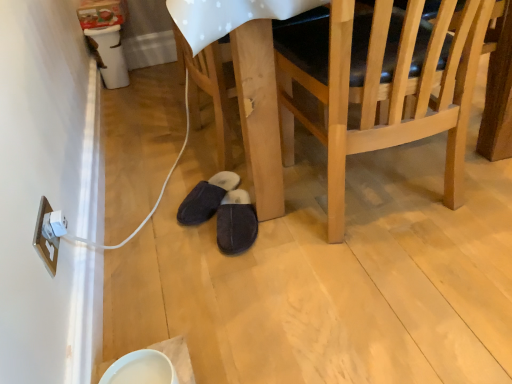
You are a GUI agent. You are given a task and a screenshot of the screen. Output one action in this format:
    pyautogui.click(x=<x>, y=<y>)
    Task: Click on the white plastic electric outlet at lower left
    The image size is (512, 384).
    Given the screenshot: What is the action you would take?
    pyautogui.click(x=46, y=238)

Locate an element on the screen. dark gray suede slippers at lower center, placed as the 2th footwear when sorted from left to right is located at coordinates (236, 223).

Is point (232, 250) more distant than point (463, 34)?

Yes, point (232, 250) is behind point (463, 34).

From their relative heights in the image, would you say dark gray suede slippers at lower center, placed as the 2th footwear when sorted from left to right, is taller or shorter than light wood chair at center?

Considering their sizes, dark gray suede slippers at lower center, placed as the 2th footwear when sorted from left to right, has less height than light wood chair at center.

From a real-world perspective, which is physically below, dark gray suede slippers at lower center, placed as the 2th footwear when sorted from left to right, or light wood chair at center?

dark gray suede slippers at lower center, placed as the 2th footwear when sorted from left to right, from a real-world perspective.

Is dark gray suede slippers at lower center, the 1th footwear from the right, closer to camera compared to light wood chair at center?

No, the depth of dark gray suede slippers at lower center, the 1th footwear from the right, is greater than that of light wood chair at center.

Where is `footwear that is the 2nd object located behind the light wood chair at center`? The width and height of the screenshot is (512, 384). footwear that is the 2nd object located behind the light wood chair at center is located at coordinates (206, 198).

Considering the relative sizes of black suede slippers at lower center, the 2th footwear positioned from the right, and light wood chair at center in the image provided, is black suede slippers at lower center, the 2th footwear positioned from the right, shorter than light wood chair at center?

Yes.

Can you tell me how much black suede slippers at lower center, the first footwear viewed from the left, and light wood chair at center differ in facing direction?

black suede slippers at lower center, the first footwear viewed from the left, and light wood chair at center are facing 142 degrees away from each other.

How far apart are black suede slippers at lower center, the first footwear viewed from the left, and light wood chair at center?

The distance of black suede slippers at lower center, the first footwear viewed from the left, from light wood chair at center is 21.58 inches.

From the picture: Does white plastic electric outlet at lower left have a larger size compared to dark gray suede slippers at lower center, placed as the 2th footwear when sorted from left to right?

Actually, white plastic electric outlet at lower left might be smaller than dark gray suede slippers at lower center, placed as the 2th footwear when sorted from left to right.

Which object is more forward, white plastic electric outlet at lower left or dark gray suede slippers at lower center, placed as the 2th footwear when sorted from left to right?

Positioned in front is white plastic electric outlet at lower left.

From a real-world perspective, is white plastic electric outlet at lower left under black suede slippers at lower center, the first footwear viewed from the left?

Incorrect, from a real-world perspective, white plastic electric outlet at lower left is higher than black suede slippers at lower center, the first footwear viewed from the left.

Is white plastic electric outlet at lower left inside or outside of black suede slippers at lower center, the first footwear viewed from the left?

white plastic electric outlet at lower left exists outside the volume of black suede slippers at lower center, the first footwear viewed from the left.

Does white plastic electric outlet at lower left turn towards black suede slippers at lower center, the 2th footwear positioned from the right?

No, white plastic electric outlet at lower left is not oriented towards black suede slippers at lower center, the 2th footwear positioned from the right.

What's the angular difference between white plastic electric outlet at lower left and black suede slippers at lower center, the first footwear viewed from the left,'s facing directions?

128 degrees separate the facing orientations of white plastic electric outlet at lower left and black suede slippers at lower center, the first footwear viewed from the left.

From a real-world perspective, is black suede slippers at lower center, the first footwear viewed from the left, above or below white plastic electric outlet at lower left?

In terms of real-world spatial position, black suede slippers at lower center, the first footwear viewed from the left, is below white plastic electric outlet at lower left.

Which is in front, black suede slippers at lower center, the first footwear viewed from the left, or white plastic electric outlet at lower left?

white plastic electric outlet at lower left.

Identify the location of the 1st footwear to the right when counting from the white plastic electric outlet at lower left. This screenshot has width=512, height=384. (206, 198).

Which is nearer, (x=188, y=224) or (x=37, y=226)?

Point (x=188, y=224) is positioned farther from the camera compared to point (x=37, y=226).

Locate an element on the screen. footwear located underneath the dark gray suede slippers at lower center, placed as the 2th footwear when sorted from left to right (from a real-world perspective) is located at coordinates (206, 198).

Are dark gray suede slippers at lower center, placed as the 2th footwear when sorted from left to right, and black suede slippers at lower center, the first footwear viewed from the left, located far from each other?

dark gray suede slippers at lower center, placed as the 2th footwear when sorted from left to right, is near black suede slippers at lower center, the first footwear viewed from the left, not far away.

Is black suede slippers at lower center, the 2th footwear positioned from the right, surrounded by dark gray suede slippers at lower center, the 1th footwear from the right?

No, black suede slippers at lower center, the 2th footwear positioned from the right, is not a part of dark gray suede slippers at lower center, the 1th footwear from the right.

Is the depth of dark gray suede slippers at lower center, the 1th footwear from the right, less than that of black suede slippers at lower center, the 2th footwear positioned from the right?

Yes.

Can you tell me how much dark gray suede slippers at lower center, placed as the 2th footwear when sorted from left to right, and white plastic electric outlet at lower left differ in facing direction?

The facing directions of dark gray suede slippers at lower center, placed as the 2th footwear when sorted from left to right, and white plastic electric outlet at lower left are 97.6 degrees apart.

Is dark gray suede slippers at lower center, the 1th footwear from the right, beside white plastic electric outlet at lower left?

No, dark gray suede slippers at lower center, the 1th footwear from the right, is not touching white plastic electric outlet at lower left.

From the image's perspective, who appears lower, dark gray suede slippers at lower center, placed as the 2th footwear when sorted from left to right, or white plastic electric outlet at lower left?

white plastic electric outlet at lower left, from the image's perspective.

Would you say dark gray suede slippers at lower center, placed as the 2th footwear when sorted from left to right, is outside white plastic electric outlet at lower left?

Yes, dark gray suede slippers at lower center, placed as the 2th footwear when sorted from left to right, is not within white plastic electric outlet at lower left.

There is a light wood chair at center. Find the location of `the 1st footwear below it (from a real-world perspective)`. the 1st footwear below it (from a real-world perspective) is located at coordinates (236, 223).

Where is `chair in front of the black suede slippers at lower center, the first footwear viewed from the left`? chair in front of the black suede slippers at lower center, the first footwear viewed from the left is located at coordinates (380, 84).

Looking at the image, which one is located closer to black suede slippers at lower center, the 2th footwear positioned from the right, white plastic electric outlet at lower left or light wood chair at center?

The object closer to black suede slippers at lower center, the 2th footwear positioned from the right, is white plastic electric outlet at lower left.

Estimate the real-world distances between objects in this image. Which object is closer to black suede slippers at lower center, the 2th footwear positioned from the right, dark gray suede slippers at lower center, the 1th footwear from the right, or light wood chair at center?

dark gray suede slippers at lower center, the 1th footwear from the right.

Estimate the real-world distances between objects in this image. Which object is closer to black suede slippers at lower center, the 2th footwear positioned from the right, white plastic electric outlet at lower left or dark gray suede slippers at lower center, placed as the 2th footwear when sorted from left to right?

dark gray suede slippers at lower center, placed as the 2th footwear when sorted from left to right, lies closer to black suede slippers at lower center, the 2th footwear positioned from the right, than the other object.

When comparing their distances from black suede slippers at lower center, the 2th footwear positioned from the right, does light wood chair at center or white plastic electric outlet at lower left seem closer?

white plastic electric outlet at lower left is positioned closer to the anchor black suede slippers at lower center, the 2th footwear positioned from the right.

From the image, which object appears to be farther from dark gray suede slippers at lower center, the 1th footwear from the right, light wood chair at center or white plastic electric outlet at lower left?

Based on the image, white plastic electric outlet at lower left appears to be further to dark gray suede slippers at lower center, the 1th footwear from the right.

From the image, which object appears to be farther from dark gray suede slippers at lower center, placed as the 2th footwear when sorted from left to right, light wood chair at center or black suede slippers at lower center, the 2th footwear positioned from the right?

light wood chair at center lies further to dark gray suede slippers at lower center, placed as the 2th footwear when sorted from left to right, than the other object.

When comparing their distances from dark gray suede slippers at lower center, placed as the 2th footwear when sorted from left to right, does white plastic electric outlet at lower left or light wood chair at center seem closer?

light wood chair at center is positioned closer to the anchor dark gray suede slippers at lower center, placed as the 2th footwear when sorted from left to right.

Considering their positions, is dark gray suede slippers at lower center, placed as the 2th footwear when sorted from left to right, positioned closer to light wood chair at center than black suede slippers at lower center, the first footwear viewed from the left?

dark gray suede slippers at lower center, placed as the 2th footwear when sorted from left to right, lies closer to light wood chair at center than the other object.

Locate an element on the screen. Image resolution: width=512 pixels, height=384 pixels. footwear between white plastic electric outlet at lower left and black suede slippers at lower center, the 2th footwear positioned from the right, along the z-axis is located at coordinates (236, 223).

At what (x,y) coordinates should I click in order to perform the action: click on footwear between light wood chair at center and black suede slippers at lower center, the 2th footwear positioned from the right, in the front-back direction. Please return your answer as a coordinate pair (x, y). Looking at the image, I should click on (236, 223).